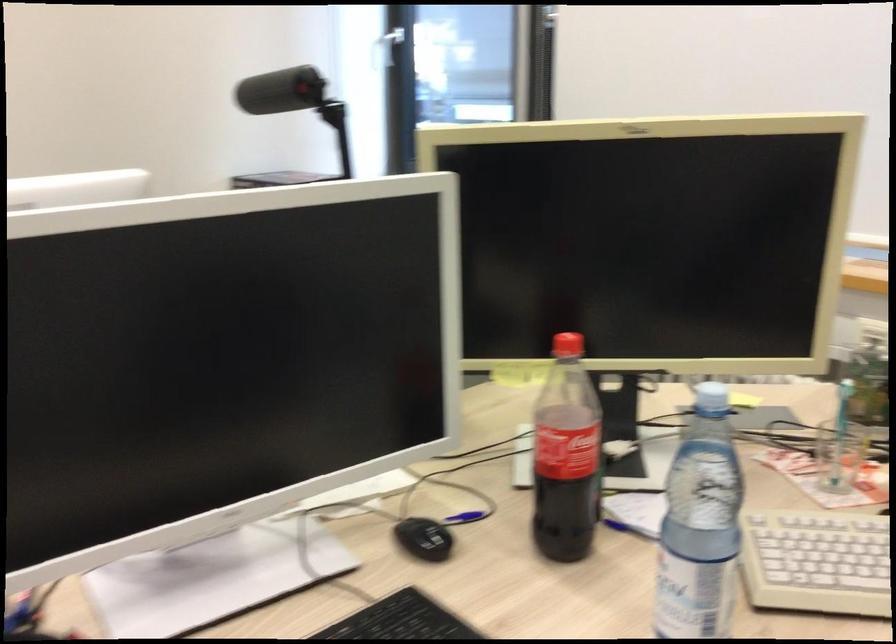
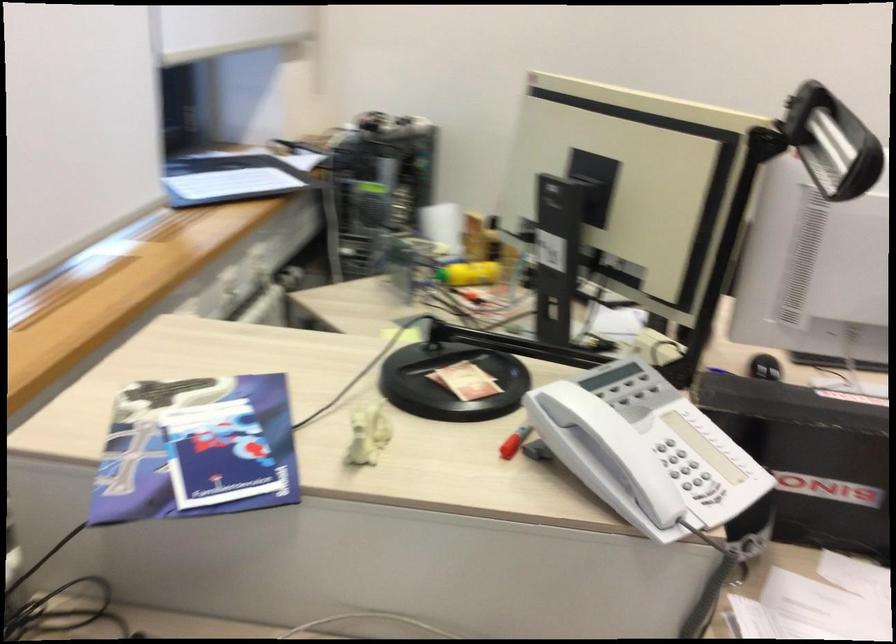
Question: I am providing you with two images of the same scene from different viewpoints. After the viewpoint changes to image2, which objects are now occluded?

Choices:
 (A) white phone handset
 (B) black board eraser
 (C) small white figurine
 (D) white keyboard

Answer: (D)